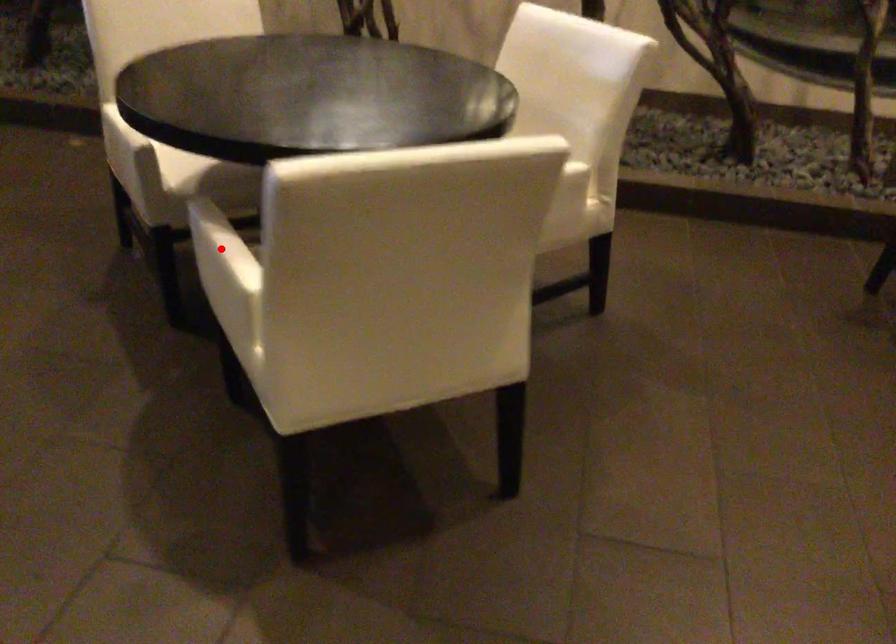
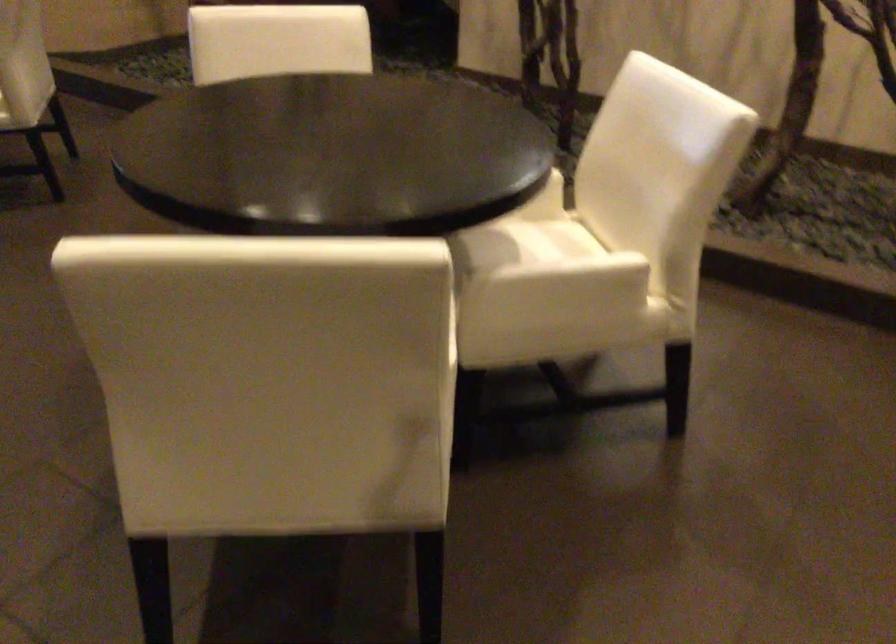
Question: I am providing you with two images of the same scene from different viewpoints. A red point is marked on the first image. Can you still see the location of the red point in image 2?

Choices:
 (A) Yes
 (B) No

Answer: (B)